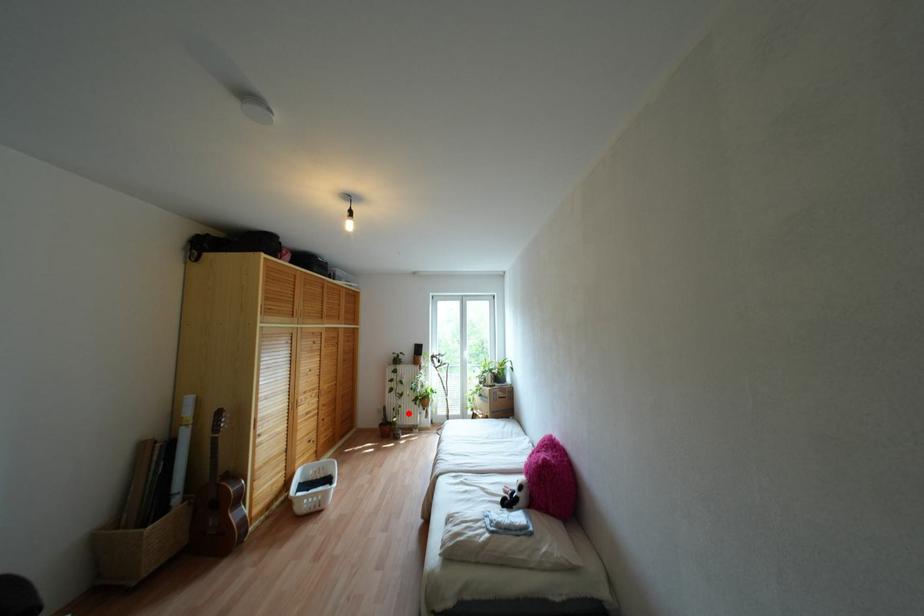
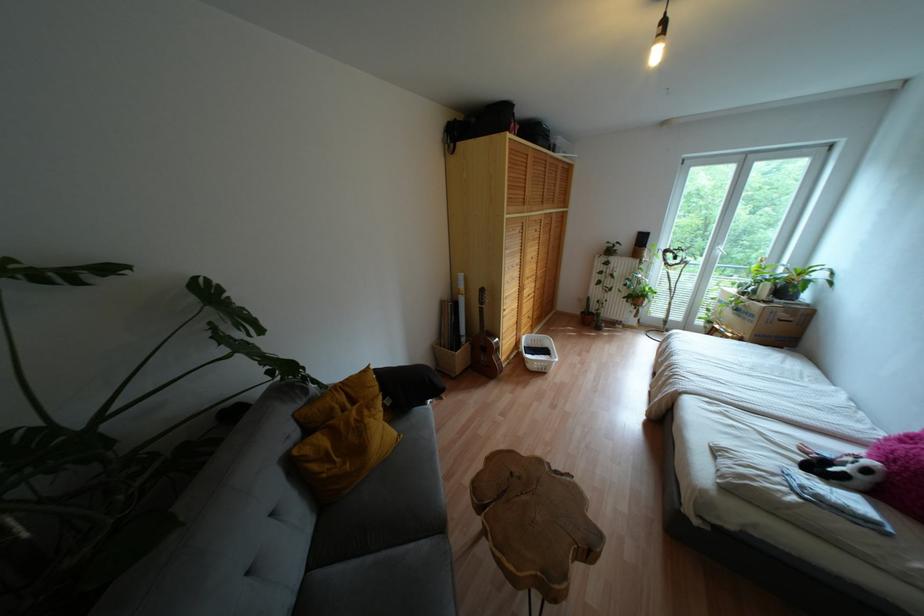
Question: A red point is marked in image1. In image2, is the corresponding 3D point closer to the camera or farther? Reply with the corresponding letter.

Choices:
 (A) The corresponding 3D point is closer.
 (B) The corresponding 3D point is farther.

Answer: (A)